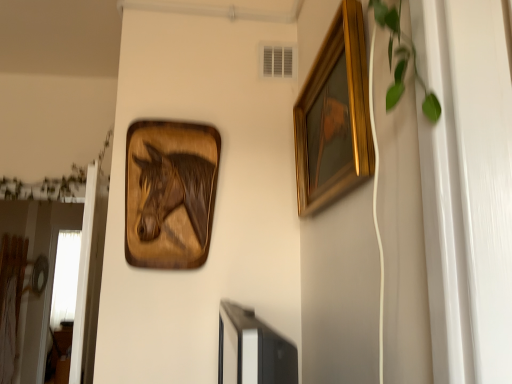
Question: Would you say green leafy plant at upper right contains gold wooden picture frame at upper right?

Choices:
 (A) no
 (B) yes

Answer: (A)

Question: From a real-world perspective, is green leafy plant at upper right positioned under gold wooden picture frame at upper right based on gravity?

Choices:
 (A) no
 (B) yes

Answer: (A)

Question: Is green leafy plant at upper right oriented away from gold wooden picture frame at upper right?

Choices:
 (A) no
 (B) yes

Answer: (A)

Question: Can you confirm if green leafy plant at upper right is wider than gold wooden picture frame at upper right?

Choices:
 (A) yes
 (B) no

Answer: (B)

Question: From the image's perspective, is green leafy plant at upper right located above gold wooden picture frame at upper right?

Choices:
 (A) yes
 (B) no

Answer: (A)

Question: Looking at their shapes, would you say green leafy plant at upper right is wider or thinner than wooden horse at upper left?

Choices:
 (A) thin
 (B) wide

Answer: (A)

Question: From the image's perspective, is green leafy plant at upper right located above or below wooden horse at upper left?

Choices:
 (A) below
 (B) above

Answer: (B)

Question: In the image, is green leafy plant at upper right positioned in front of or behind wooden horse at upper left?

Choices:
 (A) behind
 (B) front

Answer: (B)

Question: Considering the positions of green leafy plant at upper right and wooden horse at upper left in the image, is green leafy plant at upper right taller or shorter than wooden horse at upper left?

Choices:
 (A) tall
 (B) short

Answer: (B)

Question: From a real-world perspective, is wooden horse at upper left positioned above or below green leafy plant at upper right?

Choices:
 (A) below
 (B) above

Answer: (A)

Question: In terms of height, does wooden horse at upper left look taller or shorter compared to green leafy plant at upper right?

Choices:
 (A) short
 (B) tall

Answer: (B)

Question: Is wooden horse at upper left to the left or to the right of green leafy plant at upper right in the image?

Choices:
 (A) left
 (B) right

Answer: (A)

Question: Considering the positions of point (204, 230) and point (430, 119), is point (204, 230) closer or farther from the camera than point (430, 119)?

Choices:
 (A) farther
 (B) closer

Answer: (A)

Question: Would you say gold wooden picture frame at upper right is inside or outside wooden horse at upper left?

Choices:
 (A) outside
 (B) inside

Answer: (A)

Question: Based on their sizes in the image, would you say gold wooden picture frame at upper right is bigger or smaller than wooden horse at upper left?

Choices:
 (A) big
 (B) small

Answer: (A)